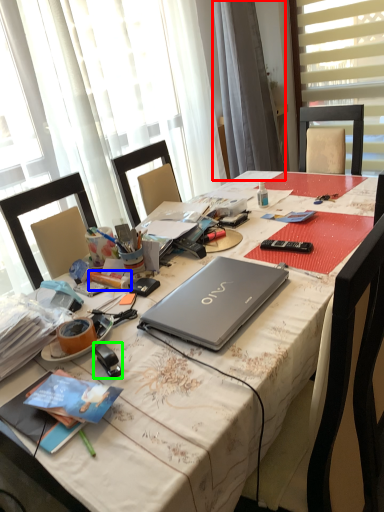
Question: Which object is the farthest from curtain (highlighted by a red box)? Choose among these: pencil (highlighted by a blue box) or stationery (highlighted by a green box).

Choices:
 (A) pencil
 (B) stationery

Answer: (B)